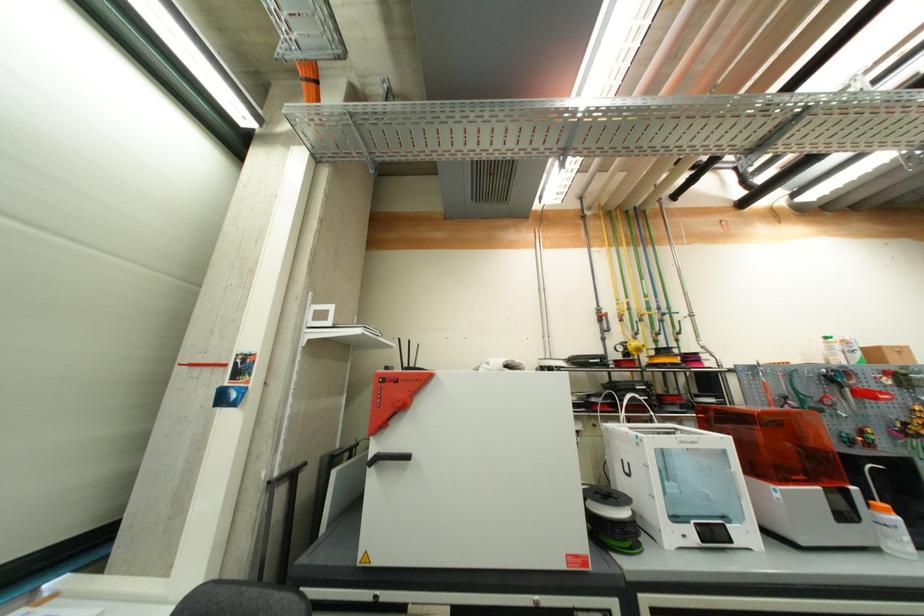
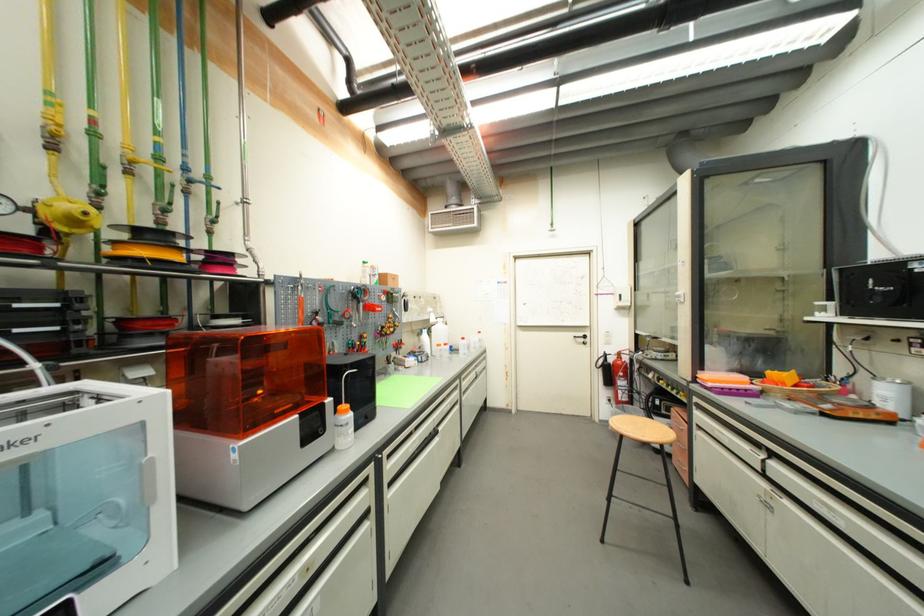
Find the pixel in the second image that matches (859,490) in the first image.

(334, 402)